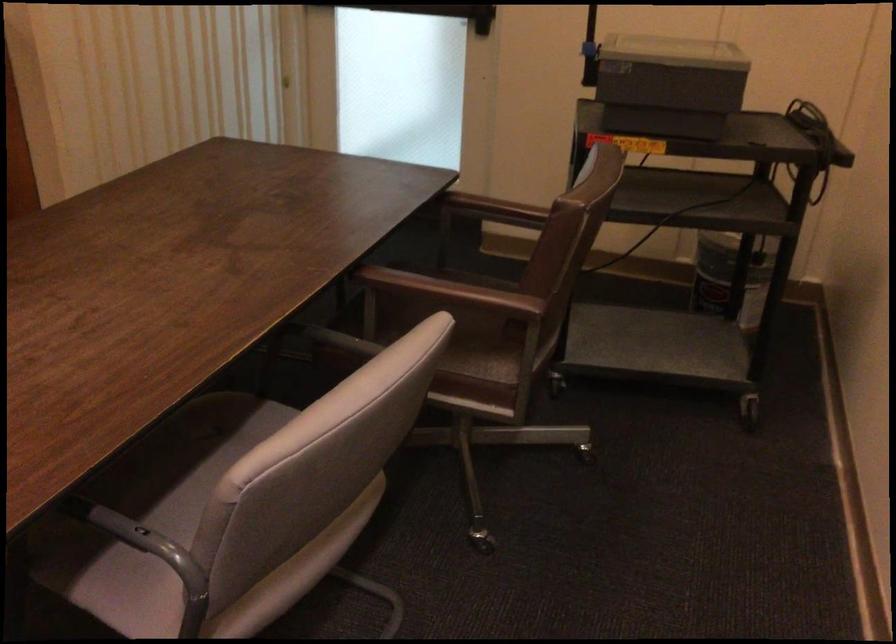
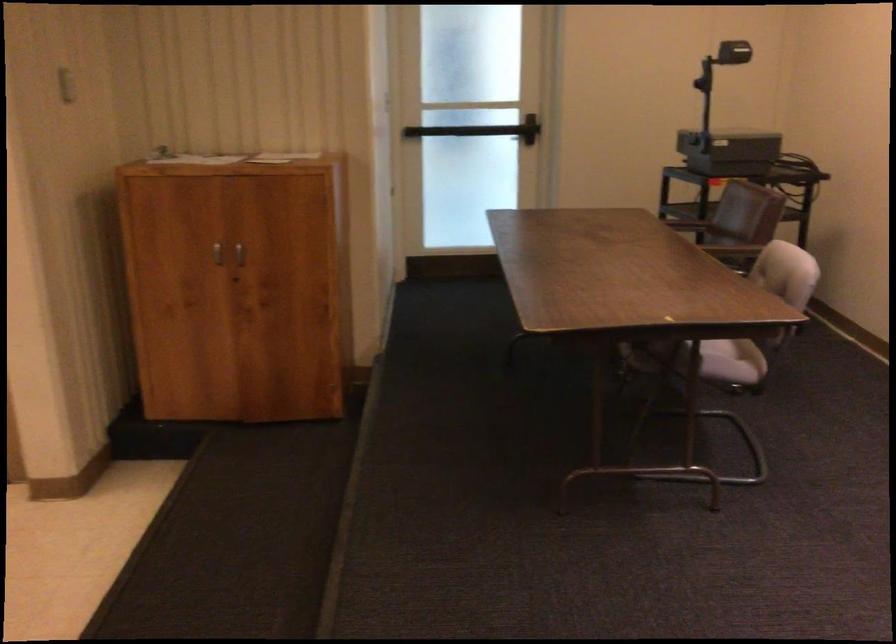
Which direction would the cameraman need to move to produce the second image?

The movement direction of the cameraman is left, backward.